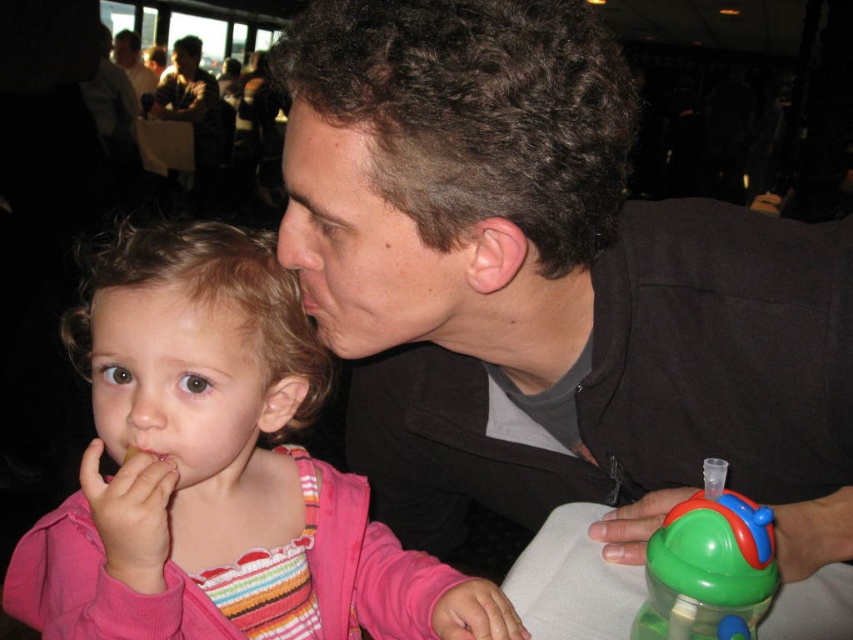
Question: Which point is closer to the camera?

Choices:
 (A) light brown skin at upper left
 (B) green plastic sippy cup at lower right
 (C) matte black shirt at upper left
 (D) pink fleece jacket at left

Answer: (B)

Question: Which of the following is the farthest from the observer?

Choices:
 (A) matte black shirt at center
 (B) light brown skin at upper left
 (C) matte black shirt at upper left

Answer: (C)

Question: Can you confirm if matte black shirt at center is positioned to the left of light brown skin at upper left?

Choices:
 (A) yes
 (B) no

Answer: (B)

Question: Is green plastic sippy cup at lower right smaller than light brown skin at upper left?

Choices:
 (A) yes
 (B) no

Answer: (B)

Question: Is matte black shirt at center in front of pink fleece jacket at left?

Choices:
 (A) yes
 (B) no

Answer: (A)

Question: Estimate the real-world distances between objects in this image. Which object is farther from the green plastic sippy cup at lower right?

Choices:
 (A) light brown skin at upper left
 (B) matte black shirt at center
 (C) matte black shirt at upper left

Answer: (C)